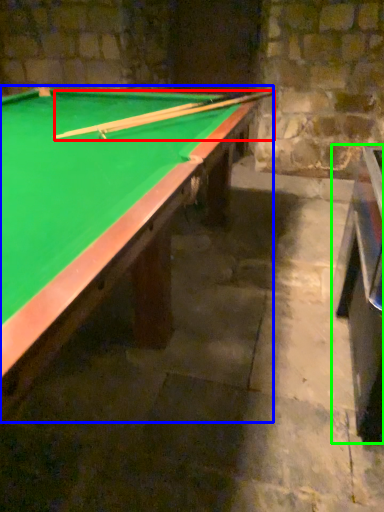
Question: Considering the real-world distances, which object is farthest from cue (highlighted by a red box)? billiard table (highlighted by a blue box) or table (highlighted by a green box)?

Choices:
 (A) billiard table
 (B) table

Answer: (B)